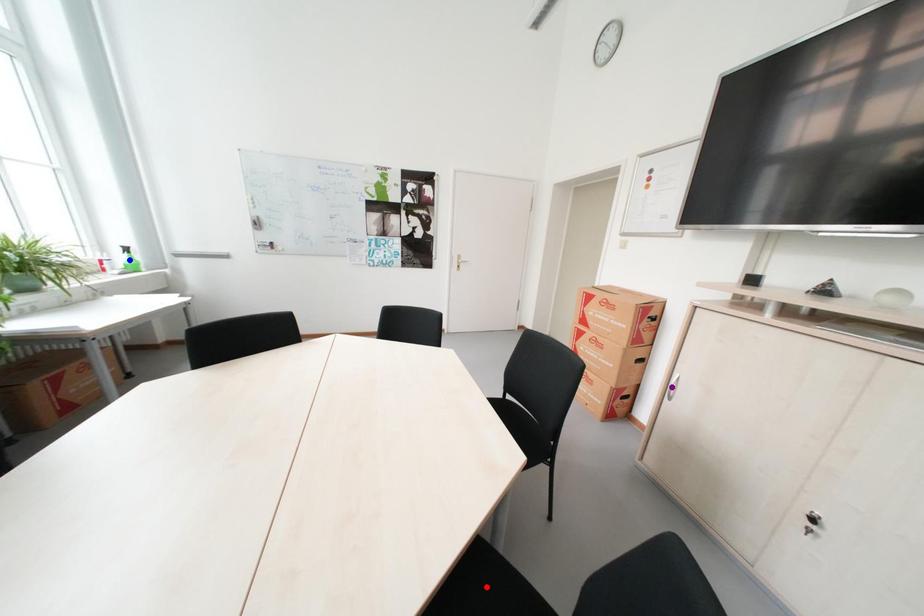
Order these from nearest to farthest:
- red point
- purple point
- blue point

blue point
purple point
red point